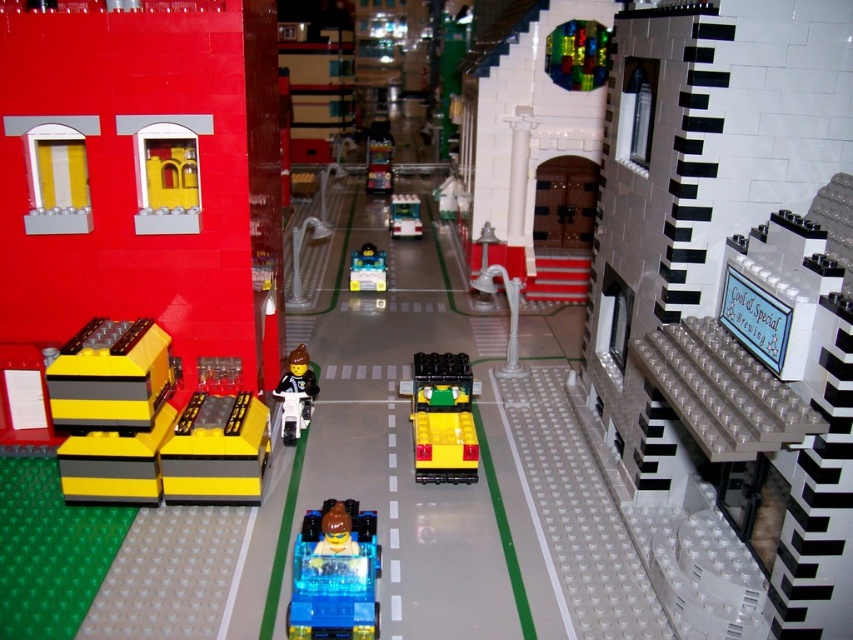
Question: Does smooth black motorcycle at center have a lesser width compared to translucent yellow plastic car at center?

Choices:
 (A) no
 (B) yes

Answer: (B)

Question: From the image, what is the correct spatial relationship of smooth black motorcycle at center in relation to translucent yellow plastic car at center?

Choices:
 (A) above
 (B) below

Answer: (B)

Question: Which object is farther from the camera taking this photo?

Choices:
 (A) translucent green plastic bus at center
 (B) yellow matte car at center

Answer: (A)

Question: Is yellow matte car at center behind translucent yellow plastic car at center?

Choices:
 (A) yes
 (B) no

Answer: (B)

Question: Considering the real-world distances, which object is farthest from the translucent blue plastic vending machine at center?

Choices:
 (A) translucent yellow plastic car at center
 (B) smooth black motorcycle at center
 (C) yellow matte car at center
 (D) transparent blue car at center

Answer: (D)

Question: Which object is closer to the camera taking this photo?

Choices:
 (A) translucent yellow plastic car at center
 (B) translucent green plastic bus at center
 (C) transparent blue car at center

Answer: (C)